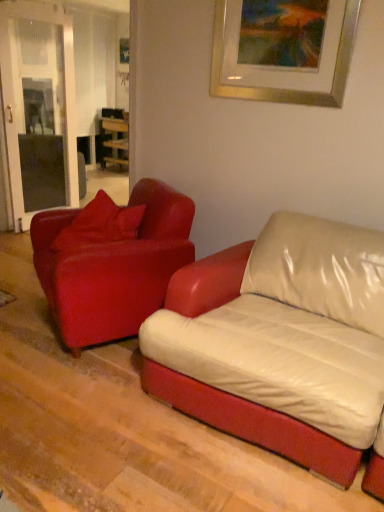
Question: From their relative heights in the image, would you say matte red pillow at left is taller or shorter than gold metallic picture frame at upper center?

Choices:
 (A) tall
 (B) short

Answer: (B)

Question: Is matte red pillow at left spatially inside gold metallic picture frame at upper center, or outside of it?

Choices:
 (A) inside
 (B) outside

Answer: (B)

Question: Considering the real-world distances, which object is closest to the matte red leather couch at left, which ranks as the 2th studio couch in left-to-right order?

Choices:
 (A) leather couch at center, placed as the 2th studio couch when sorted from right to left
 (B) gold metallic picture frame at upper center
 (C) matte red pillow at left
 (D) wooden table at center

Answer: (C)

Question: Which of these objects is positioned farthest from the matte red pillow at left?

Choices:
 (A) matte red leather couch at left, which ranks as the 2th studio couch in left-to-right order
 (B) wooden table at center
 (C) gold metallic picture frame at upper center
 (D) leather couch at center, placed as the 2th studio couch when sorted from right to left

Answer: (B)